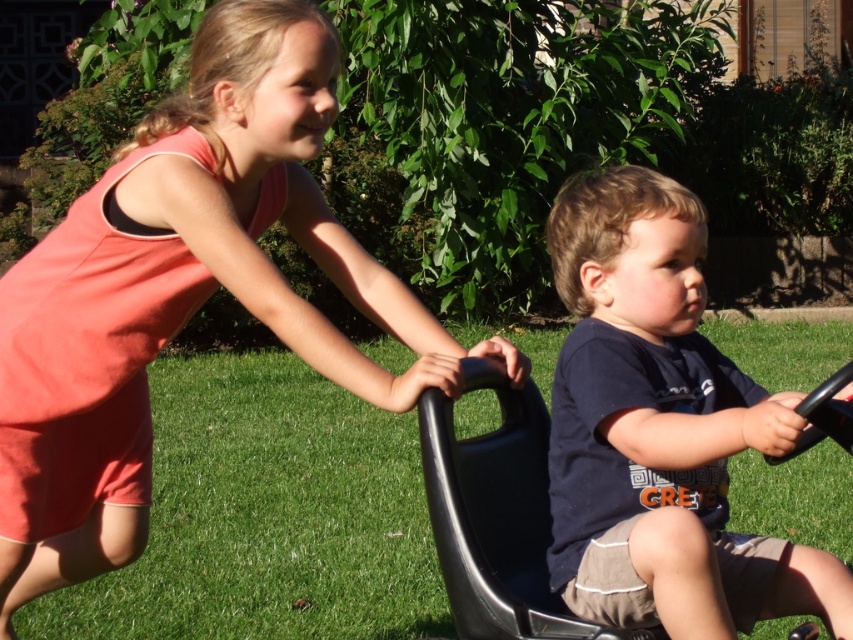
You are a photographer setting up a shoot in this scene. You want to position a light source to the left of the green grass at center. Will the light be to the left or right of the matte pink dress at upper left?

The matte pink dress at upper left is to the right of green grass at center. Since the light is placed to the left of the green grass at center, it will be to the left of the matte pink dress at upper left as well.

You are a photographer trying to capture a photo of the two children playing. You notice two specific points in the scene at coordinates point [117,477] and point [592,205]. Which of these points is closer to your camera lens?

Point [117,477] is further to the camera than point [592,205], so the point closer to the camera lens is point [592,205].